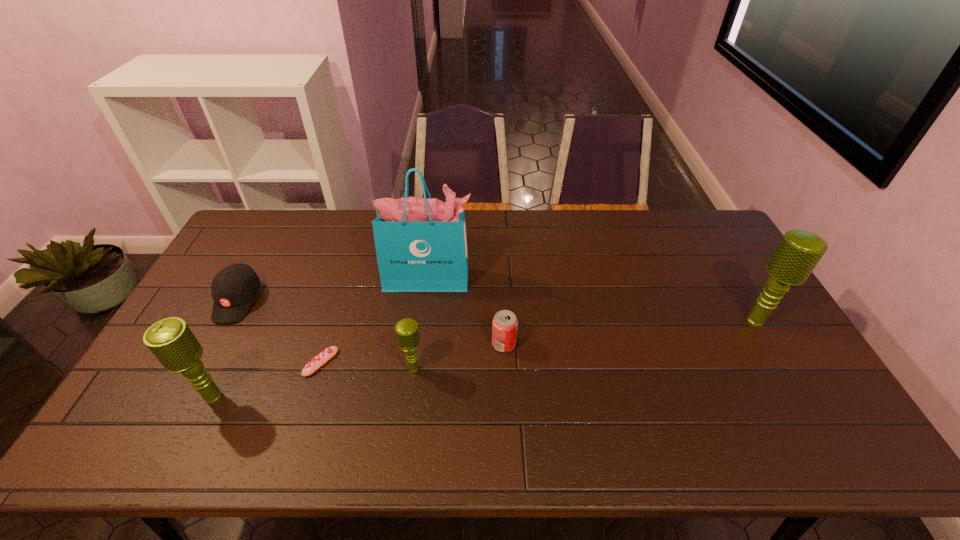
Find the location of a particular element. The width and height of the screenshot is (960, 540). baseball cap is located at coordinates (234, 288).

Find the location of a particular element. This screenshot has height=540, width=960. vacant area situated 0.110m on the right of the nearest object is located at coordinates (275, 397).

This screenshot has height=540, width=960. In order to click on free point located on the back of the second farthest microphone in this screenshot , I will do `click(426, 267)`.

Locate an element on the screen. blank space located on the front of the rightmost microphone is located at coordinates (785, 372).

Where is `free location located on the front of the tallest object`? This screenshot has height=540, width=960. free location located on the front of the tallest object is located at coordinates (416, 389).

At what (x,y) coordinates should I click in order to perform the action: click on free space located on the left of the eclair. Please return your answer as a coordinate pair (x, y). Image resolution: width=960 pixels, height=540 pixels. Looking at the image, I should click on (214, 362).

Locate an element on the screen. vacant space situated 0.140m on the front of the soda can is located at coordinates (507, 399).

The width and height of the screenshot is (960, 540). What are the coordinates of `vacant space situated 0.090m with a logo on the front of the baseball cap` in the screenshot? It's located at (211, 350).

At what (x,y) coordinates should I click in order to perform the action: click on object present at the near edge. Please return your answer as a coordinate pair (x, y). The height and width of the screenshot is (540, 960). Looking at the image, I should click on (171, 341).

Identify the location of microphone present at the left edge. The image size is (960, 540). (171, 341).